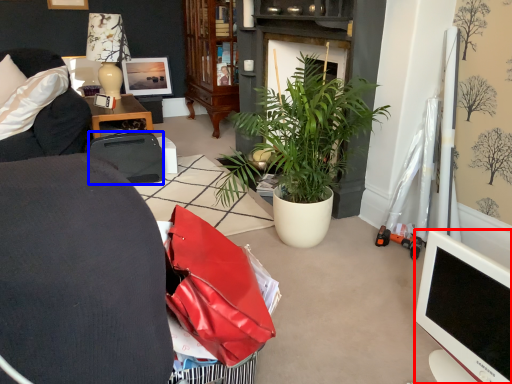
Question: Which point is further to the camera, television (highlighted by a red box) or luggage and bags (highlighted by a blue box)?

Choices:
 (A) television
 (B) luggage and bags

Answer: (B)